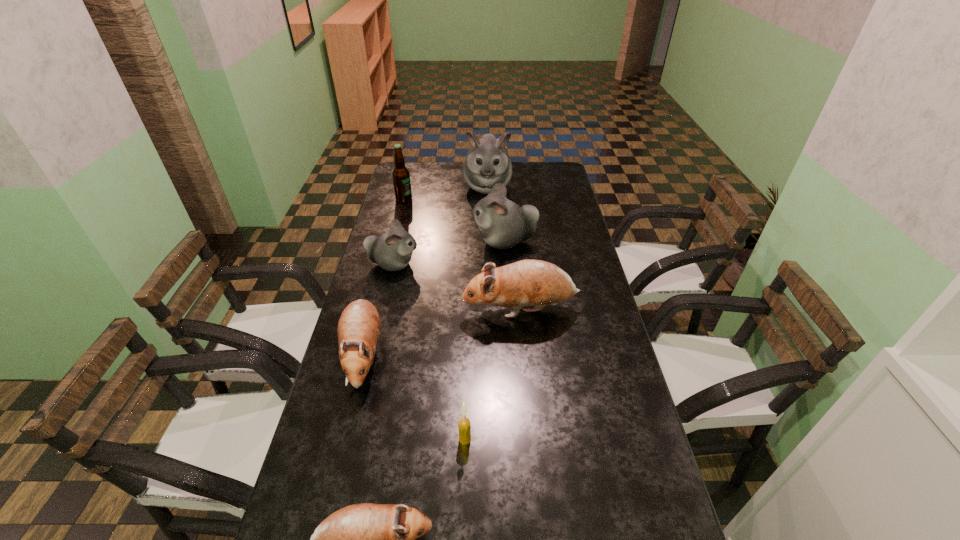
Locate an element on the screen. The image size is (960, 540). object that is at the far edge is located at coordinates (487, 163).

Image resolution: width=960 pixels, height=540 pixels. Find the location of `beer bottle positioned at the left edge`. beer bottle positioned at the left edge is located at coordinates (401, 176).

Where is `object present at the right edge`? The image size is (960, 540). object present at the right edge is located at coordinates (537, 283).

At what (x,y) coordinates should I click in order to perform the action: click on vacant space at the far edge of the desktop. Please return your answer as a coordinate pair (x, y). The height and width of the screenshot is (540, 960). Looking at the image, I should click on (456, 174).

Image resolution: width=960 pixels, height=540 pixels. In the image, there is a desktop. What are the coordinates of `vacant space at the left edge` in the screenshot? It's located at (325, 489).

The width and height of the screenshot is (960, 540). I want to click on free space at the right edge of the desktop, so coord(600,289).

Locate an element on the screen. This screenshot has height=540, width=960. free space at the far right corner of the desktop is located at coordinates (561, 183).

At what (x,y) coordinates should I click in order to perform the action: click on vacant space that's between the brown beer bottle and the farthest hamster. Please return your answer as a coordinate pair (x, y). Image resolution: width=960 pixels, height=540 pixels. Looking at the image, I should click on (445, 193).

Where is `vacant space in between the beer bottle and the second biggest brown hamster`? The height and width of the screenshot is (540, 960). vacant space in between the beer bottle and the second biggest brown hamster is located at coordinates (384, 277).

You are a GUI agent. You are given a task and a screenshot of the screen. Output one action in this format:
    pyautogui.click(x=<x>, y=<y>)
    Task: Click on the empty space that is in between the second biggest white hamster and the seventh farthest object
    Image resolution: width=960 pixels, height=540 pixels.
    Given the screenshot: What is the action you would take?
    pyautogui.click(x=485, y=340)